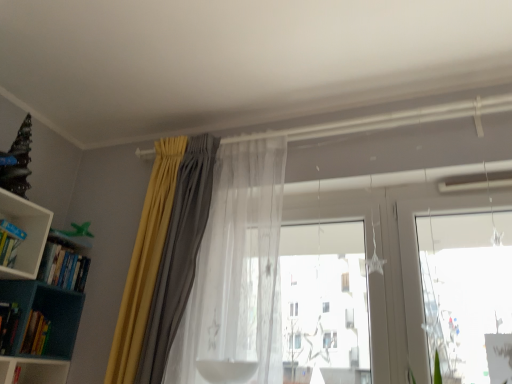
Question: Looking at their shapes, would you say hardcover books at left, marked as the 4th book in a top-to-bottom arrangement, is wider or thinner than hardcover book at left, which is counted as the 1th book, starting from the top?

Choices:
 (A) thin
 (B) wide

Answer: (A)

Question: Is hardcover books at left, which is counted as the first book, starting from the bottom, inside the boundaries of hardcover book at left, arranged as the 4th book when ordered from the bottom, or outside?

Choices:
 (A) inside
 (B) outside

Answer: (B)

Question: Which is farther from the translucent fabric at center?

Choices:
 (A) hardcover books at left, which is the 2th book from top to bottom
 (B) translucent sheer curtain at center, which is the 2th curtain from left to right
 (C) yellow fabric curtain at upper left, which ranks as the first curtain in left-to-right order
 (D) hardcover book at lower left, arranged as the 2th book when ordered from the bottom
 (E) hardcover books at left, marked as the 4th book in a top-to-bottom arrangement

Answer: (D)

Question: Which object is positioned farthest from the hardcover book at left, arranged as the 4th book when ordered from the bottom?

Choices:
 (A) hardcover books at left, which is the 3th book in bottom-to-top order
 (B) hardcover books at left, which is counted as the first book, starting from the bottom
 (C) translucent sheer curtain at center, which is the 2th curtain from left to right
 (D) translucent fabric at center
 (E) yellow fabric curtain at upper left, the second curtain viewed from the right

Answer: (D)